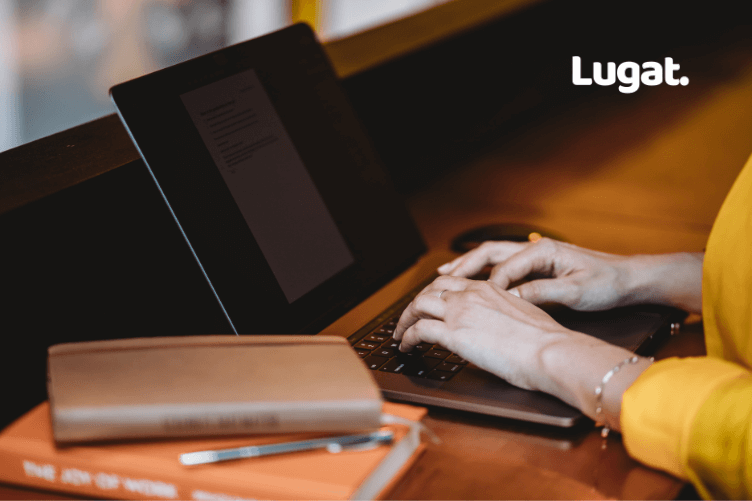
Find the location of `spine of orange book`. spine of orange book is located at coordinates (68, 478).